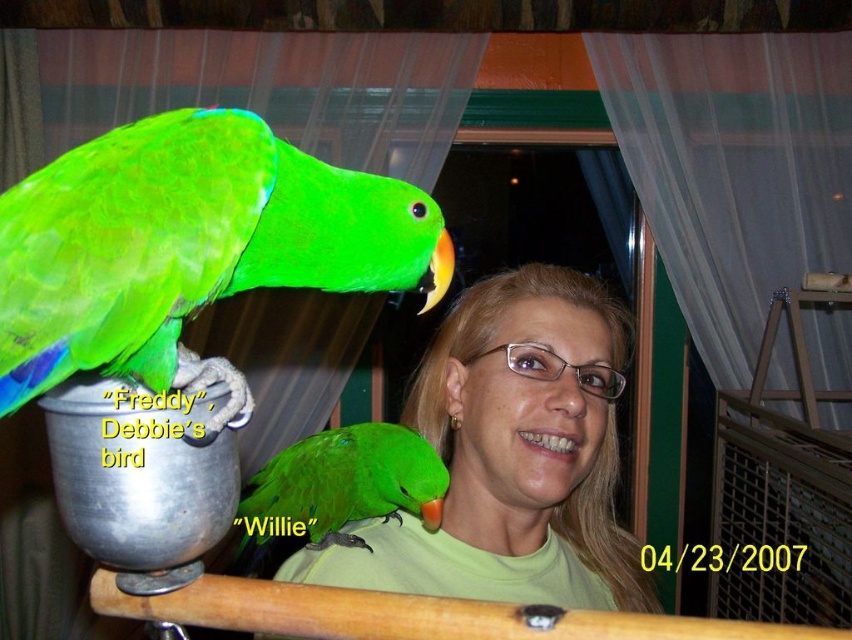
Question: Does green matte parrot at upper left appear over matte green shirt at center?

Choices:
 (A) no
 (B) yes

Answer: (B)

Question: Does green matte parrot at upper left appear on the right side of matte green shirt at center?

Choices:
 (A) no
 (B) yes

Answer: (A)

Question: Considering the real-world distances, which object is farthest from the green matte parrot at shoulder?

Choices:
 (A) matte green shirt at center
 (B) green matte parrot at upper left

Answer: (B)

Question: Which of the following is the farthest from the observer?

Choices:
 (A) matte green shirt at center
 (B) green matte parrot at upper left

Answer: (A)

Question: Estimate the real-world distances between objects in this image. Which object is farther from the green matte parrot at shoulder?

Choices:
 (A) green matte parrot at upper left
 (B) matte green shirt at center

Answer: (A)

Question: Can you confirm if matte green shirt at center is positioned to the right of green matte parrot at shoulder?

Choices:
 (A) no
 (B) yes

Answer: (B)